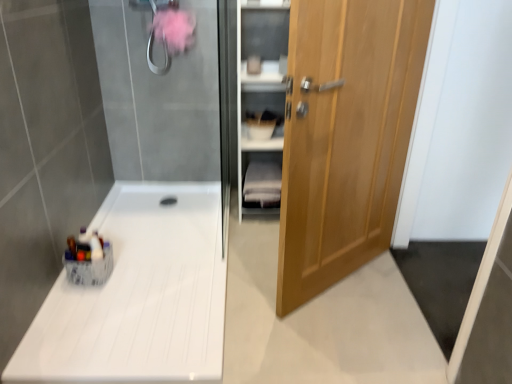
Question: From the image's perspective, is white fabric shelf at center on top of white glossy counter top at lower left?

Choices:
 (A) yes
 (B) no

Answer: (A)

Question: Is white fabric shelf at center closer to the viewer compared to white glossy counter top at lower left?

Choices:
 (A) yes
 (B) no

Answer: (B)

Question: Is white glossy counter top at lower left inside white fabric shelf at center?

Choices:
 (A) no
 (B) yes

Answer: (A)

Question: Does white fabric shelf at center have a larger size compared to white glossy counter top at lower left?

Choices:
 (A) no
 (B) yes

Answer: (A)

Question: Can you confirm if white fabric shelf at center is taller than white glossy counter top at lower left?

Choices:
 (A) yes
 (B) no

Answer: (A)

Question: Is white fabric shelf at center not close to white glossy counter top at lower left?

Choices:
 (A) no
 (B) yes

Answer: (A)

Question: Is light brown wooden door at right completely or partially inside wooden cabinet at right?

Choices:
 (A) no
 (B) yes

Answer: (A)

Question: Can you confirm if wooden cabinet at right is shorter than light brown wooden door at right?

Choices:
 (A) yes
 (B) no

Answer: (A)

Question: Could you tell me if wooden cabinet at right is facing light brown wooden door at right?

Choices:
 (A) no
 (B) yes

Answer: (B)

Question: Is wooden cabinet at right facing away from light brown wooden door at right?

Choices:
 (A) yes
 (B) no

Answer: (B)

Question: Does wooden cabinet at right have a larger size compared to light brown wooden door at right?

Choices:
 (A) yes
 (B) no

Answer: (B)

Question: From a real-world perspective, is wooden cabinet at right on light brown wooden door at right?

Choices:
 (A) yes
 (B) no

Answer: (B)

Question: From the image's perspective, is white fabric shelf at center under light brown wooden door at right?

Choices:
 (A) no
 (B) yes

Answer: (B)